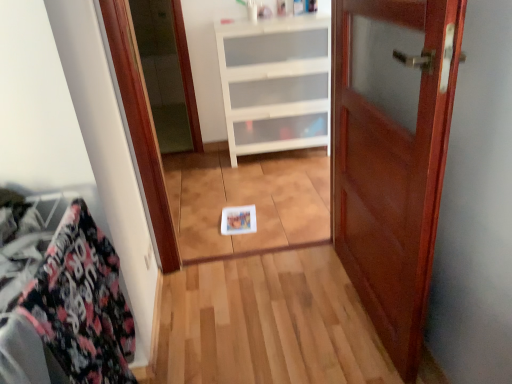
Question: Considering the relative positions of mahogany wood door at center and floral fabric at left in the image provided, is mahogany wood door at center behind floral fabric at left?

Choices:
 (A) yes
 (B) no

Answer: (A)

Question: Can you confirm if mahogany wood door at center is thinner than floral fabric at left?

Choices:
 (A) no
 (B) yes

Answer: (B)

Question: From the image's perspective, is mahogany wood door at center over floral fabric at left?

Choices:
 (A) no
 (B) yes

Answer: (B)

Question: Would you say mahogany wood door at center is a long distance from floral fabric at left?

Choices:
 (A) yes
 (B) no

Answer: (B)

Question: Is the position of mahogany wood door at center less distant than that of floral fabric at left?

Choices:
 (A) no
 (B) yes

Answer: (A)

Question: Does mahogany wood door at center have a larger size compared to floral fabric at left?

Choices:
 (A) yes
 (B) no

Answer: (A)

Question: Is white plastic drawer at center next to mahogany wood door at center and touching it?

Choices:
 (A) yes
 (B) no

Answer: (B)

Question: Can you confirm if white plastic drawer at center is taller than mahogany wood door at center?

Choices:
 (A) yes
 (B) no

Answer: (B)

Question: Is white plastic drawer at center facing away from mahogany wood door at center?

Choices:
 (A) yes
 (B) no

Answer: (B)

Question: Is white plastic drawer at center thinner than mahogany wood door at center?

Choices:
 (A) yes
 (B) no

Answer: (B)

Question: Is the position of white plastic drawer at center less distant than that of mahogany wood door at center?

Choices:
 (A) no
 (B) yes

Answer: (A)

Question: Would you say white plastic drawer at center is outside mahogany wood door at center?

Choices:
 (A) yes
 (B) no

Answer: (A)

Question: From the image's perspective, would you say floral fabric at left is shown under white plastic drawer at center?

Choices:
 (A) no
 (B) yes

Answer: (B)